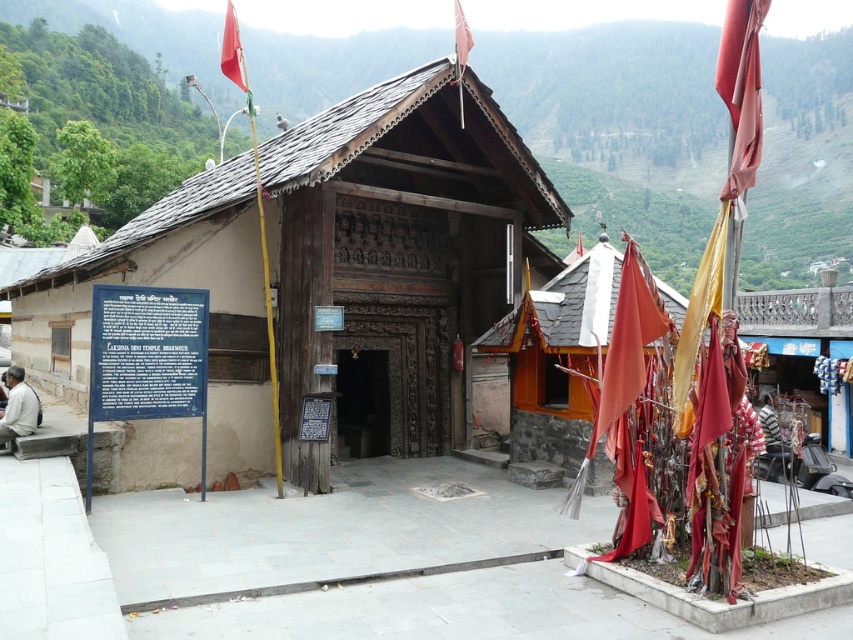
In the scene shown: You are a visitor at the temple and want to take a photo of the wooden shrine at center and the shiny red flag at upper left. Which object should you focus on first if you want to capture both in a single frame without moving the camera?

The wooden shrine at center is thinner than the shiny red flag at upper left, so you should focus on the shiny red flag at upper left first to ensure it fits within the frame since it is wider.

You are standing at the entrance of the temple and want to locate the light beige stone man at lower left. According to the coordinates provided, where should you look relative to the temple entrance?

The light beige stone man at lower left is located at coordinates point (18, 406), which is to the lower left of the temple entrance.

You are a photographer planning to capture the wooden shrine at center and the shiny red flag at upper left in a single frame. Based on their heights, which object will appear taller in the photo?

The shiny red flag at upper left appears taller in the photo because the wooden shrine at center has a lesser height compared to it.